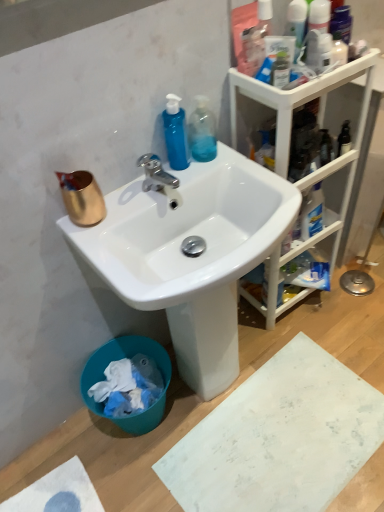
Locate an element on the screen. Image resolution: width=384 pixels, height=512 pixels. free space between transparent plastic bottle at upper center, the second cleaning product from the left, and chrome metallic faucet at upper center is located at coordinates point(191,174).